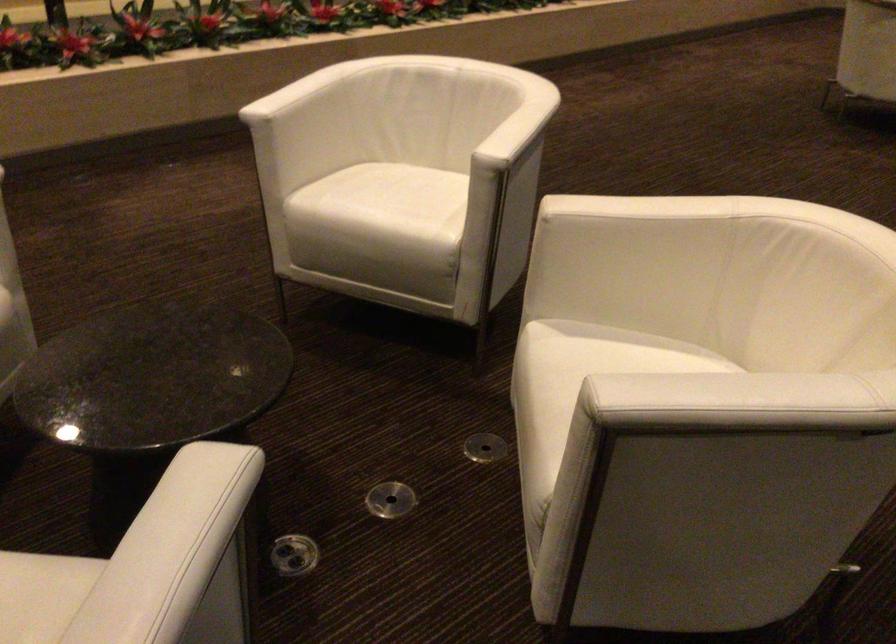
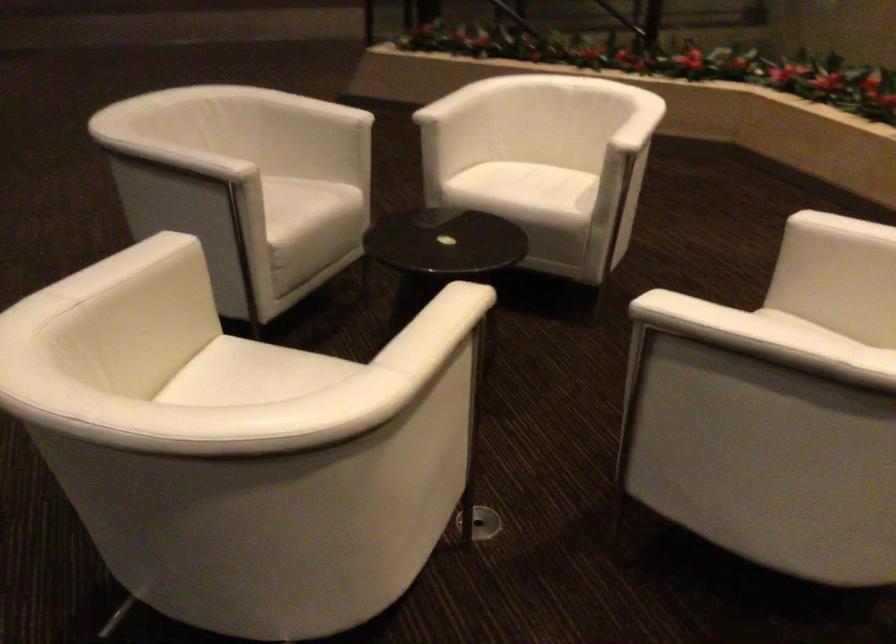
In the second image, find the point that corresponds to [609,204] in the first image.

(437, 308)